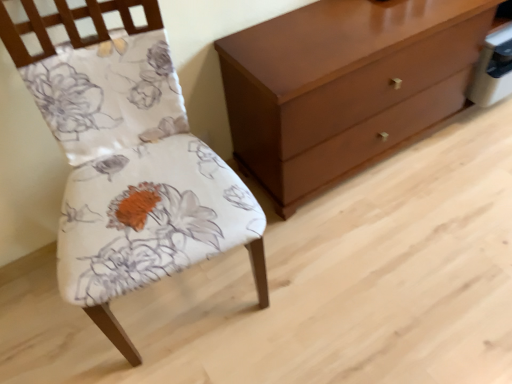
Find the location of a particular element. free point to the right of floral fabric chair at left is located at coordinates (330, 278).